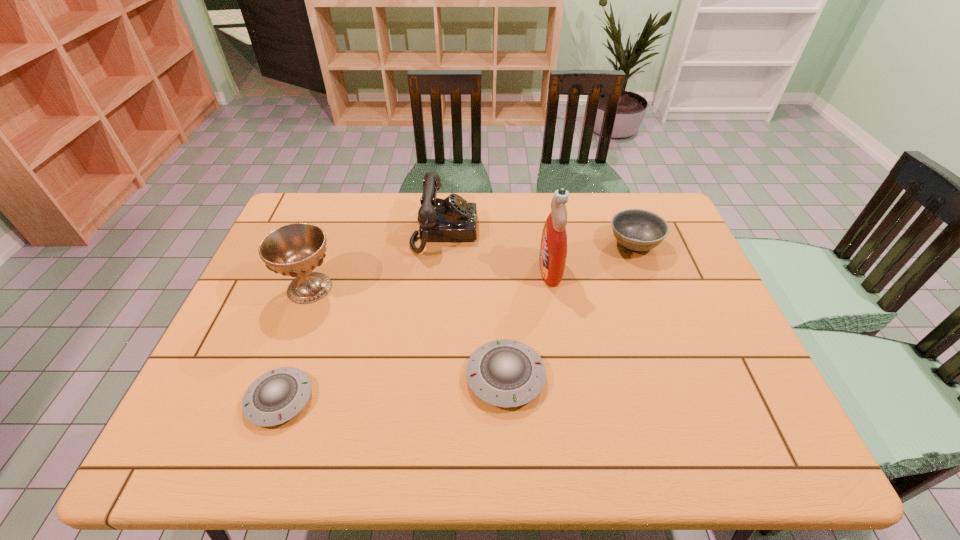
Find the location of `free space between the left saucer and the telephone`. free space between the left saucer and the telephone is located at coordinates (362, 315).

Identify the location of free space between the telephone and the right saucer. The width and height of the screenshot is (960, 540). (475, 304).

The height and width of the screenshot is (540, 960). Identify the location of vacant region between the left saucer and the chalice. 295,343.

Find the location of a particular element. This screenshot has width=960, height=540. vacant space in between the left saucer and the detergent is located at coordinates (415, 334).

At what (x,y) coordinates should I click in order to perform the action: click on blank region between the fourth tallest object and the chalice. Please return your answer as a coordinate pair (x, y). Image resolution: width=960 pixels, height=540 pixels. Looking at the image, I should click on tap(471, 266).

Locate an element on the screen. This screenshot has height=540, width=960. free spot between the taller saucer and the chalice is located at coordinates (407, 332).

The width and height of the screenshot is (960, 540). I want to click on free space between the chalice and the shorter saucer, so click(295, 343).

The width and height of the screenshot is (960, 540). I want to click on free space between the second shortest object and the left saucer, so click(x=393, y=388).

Identify the location of unoccupied position between the fifth object from left to right and the shorter saucer. (415, 334).

Identify the location of empty space that is in between the bowl and the detergent. (592, 256).